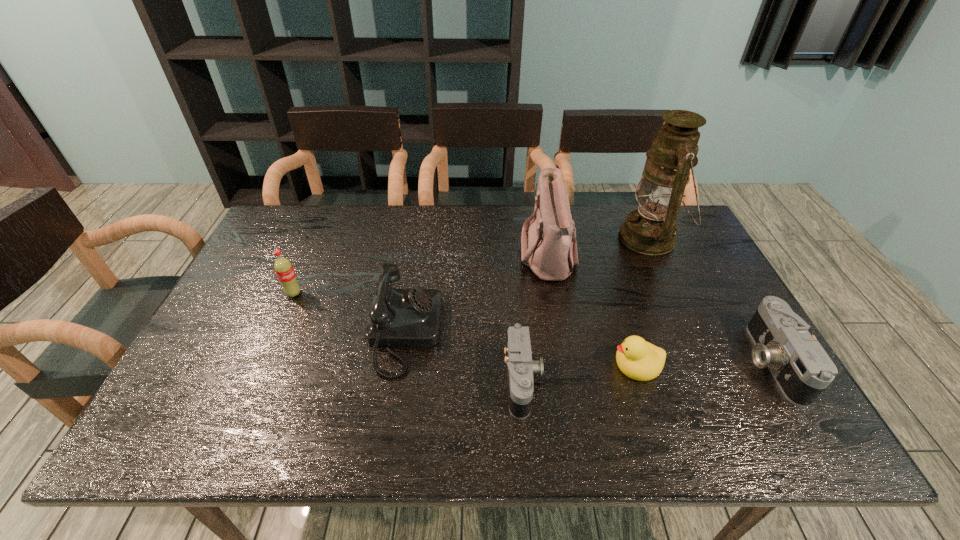
Identify the location of the left camera. (520, 367).

Locate an element on the screen. the third shortest object is located at coordinates (802, 369).

Find the location of `the right camera`. the right camera is located at coordinates (802, 369).

Identify the location of shoulder bag. (549, 248).

Image resolution: width=960 pixels, height=540 pixels. What are the coordinates of `the sixth object from right to left` in the screenshot? It's located at [x=398, y=317].

Identify the location of the tallest object. (650, 230).

Locate an element on the screen. the second object from right to left is located at coordinates (650, 230).

Locate an element on the screen. This screenshot has height=540, width=960. soda is located at coordinates (283, 267).

Find the location of `duckling`. duckling is located at coordinates (638, 359).

Identify the location of vacant space located on the lens of the left camera. (571, 381).